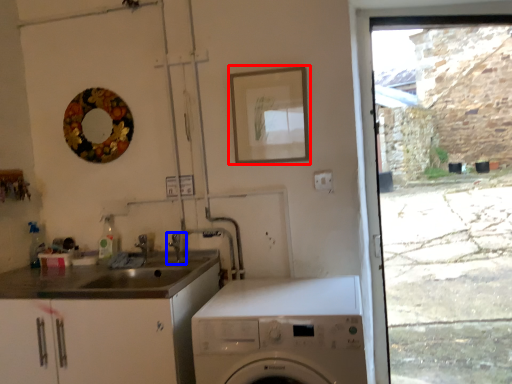
Question: Which object is closer to the camera taking this photo, picture frame (highlighted by a red box) or tap (highlighted by a blue box)?

Choices:
 (A) picture frame
 (B) tap

Answer: (A)